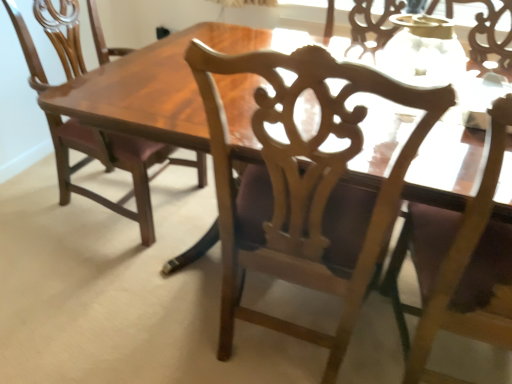
Question: In which direction should I rotate to look at wooden carved chair at center, which ranks as the 2th chair in left-to-right order?

Choices:
 (A) right
 (B) left

Answer: (A)

Question: Does wooden carved chair at center, which ranks as the 2th chair in left-to-right order, come in front of matte wood chair at left, which appears as the first chair when viewed from the left?

Choices:
 (A) yes
 (B) no

Answer: (A)

Question: Is wooden carved chair at center, which ranks as the 2th chair in left-to-right order, at the right side of matte wood chair at left, which appears as the first chair when viewed from the left?

Choices:
 (A) no
 (B) yes

Answer: (B)

Question: Considering the relative sizes of wooden carved chair at center, which ranks as the 2th chair in left-to-right order, and matte wood chair at left, acting as the third chair starting from the right, in the image provided, is wooden carved chair at center, which ranks as the 2th chair in left-to-right order, wider than matte wood chair at left, acting as the third chair starting from the right,?

Choices:
 (A) yes
 (B) no

Answer: (B)

Question: Are wooden carved chair at center, which ranks as the 2th chair in left-to-right order, and matte wood chair at left, which appears as the first chair when viewed from the left, making contact?

Choices:
 (A) yes
 (B) no

Answer: (B)

Question: From the image's perspective, would you say wooden carved chair at center, which ranks as the 2th chair in right-to-left order, is shown under matte wood chair at left, acting as the third chair starting from the right?

Choices:
 (A) no
 (B) yes

Answer: (B)

Question: Is matte wood chair at left, which appears as the first chair when viewed from the left, a part of wooden carved chair at center, which ranks as the 2th chair in right-to-left order?

Choices:
 (A) yes
 (B) no

Answer: (B)

Question: Considering the relative sizes of light wood chair at upper right, which ranks as the first chair in right-to-left order, and matte wood chair at left, acting as the third chair starting from the right, in the image provided, is light wood chair at upper right, which ranks as the first chair in right-to-left order, taller than matte wood chair at left, acting as the third chair starting from the right,?

Choices:
 (A) no
 (B) yes

Answer: (B)

Question: Is light wood chair at upper right, marked as the third chair in a left-to-right arrangement, completely or partially outside of matte wood chair at left, acting as the third chair starting from the right?

Choices:
 (A) no
 (B) yes

Answer: (B)

Question: Considering the relative sizes of light wood chair at upper right, which ranks as the first chair in right-to-left order, and matte wood chair at left, which appears as the first chair when viewed from the left, in the image provided, is light wood chair at upper right, which ranks as the first chair in right-to-left order, smaller than matte wood chair at left, which appears as the first chair when viewed from the left,?

Choices:
 (A) no
 (B) yes

Answer: (B)

Question: Considering the relative sizes of light wood chair at upper right, which ranks as the first chair in right-to-left order, and matte wood chair at left, acting as the third chair starting from the right, in the image provided, is light wood chair at upper right, which ranks as the first chair in right-to-left order, shorter than matte wood chair at left, acting as the third chair starting from the right,?

Choices:
 (A) no
 (B) yes

Answer: (A)

Question: Is light wood chair at upper right, marked as the third chair in a left-to-right arrangement, beside matte wood chair at left, which appears as the first chair when viewed from the left?

Choices:
 (A) yes
 (B) no

Answer: (B)

Question: From the image's perspective, does matte wood chair at left, acting as the third chair starting from the right, appear higher than light wood chair at upper right, which ranks as the first chair in right-to-left order?

Choices:
 (A) yes
 (B) no

Answer: (A)